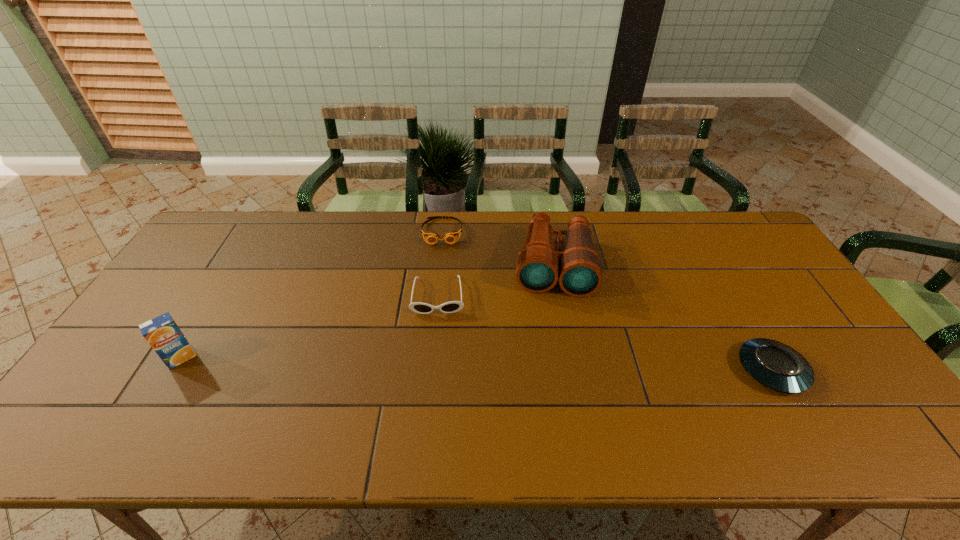
This screenshot has width=960, height=540. Find the location of `vacant space that is in between the rightmost object and the goggles`. vacant space that is in between the rightmost object and the goggles is located at coordinates (607, 301).

Where is `vacant space that is in between the orange_juice and the second object from right to left`? The image size is (960, 540). vacant space that is in between the orange_juice and the second object from right to left is located at coordinates [x=367, y=312].

Identify the location of free spot between the fourth object from left to right and the saucer. (662, 318).

Locate an element on the screen. The width and height of the screenshot is (960, 540). free spot between the goggles and the sunglasses is located at coordinates (441, 264).

Identify the location of vacant space that is in between the saucer and the binoculars. This screenshot has width=960, height=540. (662, 318).

The width and height of the screenshot is (960, 540). I want to click on vacant area that lies between the orange_juice and the saucer, so (x=476, y=364).

Find the location of a particular element. This screenshot has height=540, width=960. free point between the binoculars and the orange_juice is located at coordinates (367, 312).

Identify the location of object that can be found as the third closest to the binoculars. (775, 365).

Find the location of a particular element. the second closest object to the orange_juice is located at coordinates (450, 237).

You are a GUI agent. You are given a task and a screenshot of the screen. Output one action in this format:
    pyautogui.click(x=<x>, y=<y>)
    Task: Click on the free location that satisfies the following two spatial constraints: 1. on the front side of the saucer; 2. on the right side of the binoculars
    Image resolution: width=960 pixels, height=540 pixels.
    Given the screenshot: What is the action you would take?
    pyautogui.click(x=571, y=370)